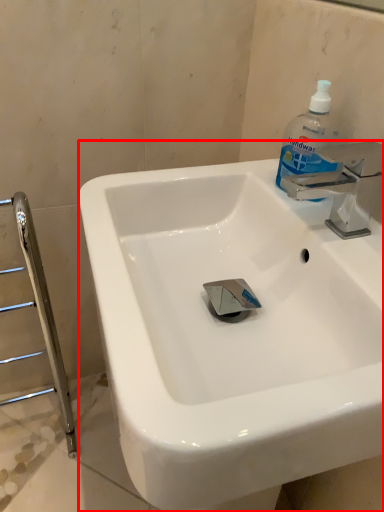
Question: From the image's perspective, where is sink (annotated by the red box) located relative to cleaning product?

Choices:
 (A) below
 (B) above

Answer: (A)